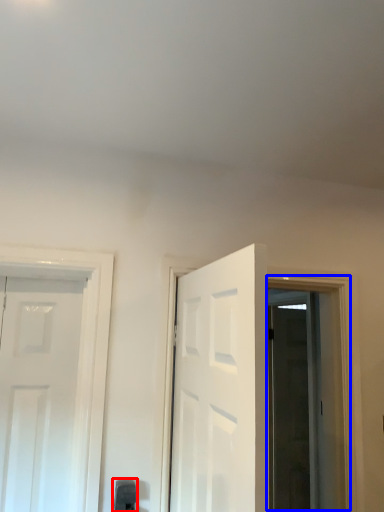
Question: Which object appears farthest to the camera in this image, door handle (highlighted by a red box) or window (highlighted by a blue box)?

Choices:
 (A) door handle
 (B) window

Answer: (B)